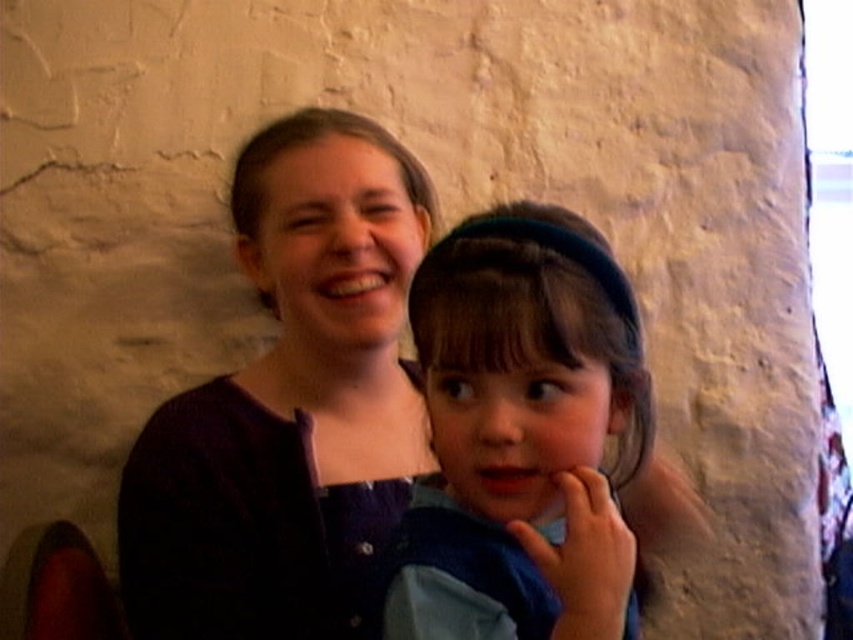
Question: Can you confirm if matte purple sweater at center is wider than blue fabric at center?

Choices:
 (A) yes
 (B) no

Answer: (A)

Question: From the image, what is the correct spatial relationship of matte purple sweater at center in relation to blue fabric at center?

Choices:
 (A) above
 (B) below

Answer: (A)

Question: Is matte purple sweater at center thinner than blue fabric at center?

Choices:
 (A) no
 (B) yes

Answer: (A)

Question: Which point is closer to the camera?

Choices:
 (A) (498, 445)
 (B) (321, 577)

Answer: (A)